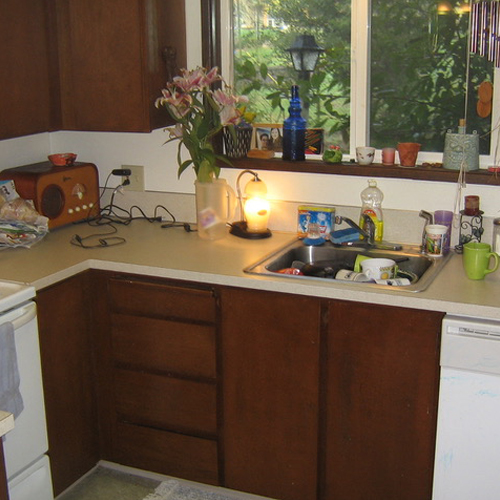
Locate an element on the screen. The width and height of the screenshot is (500, 500). rug on floor is located at coordinates (178, 495).